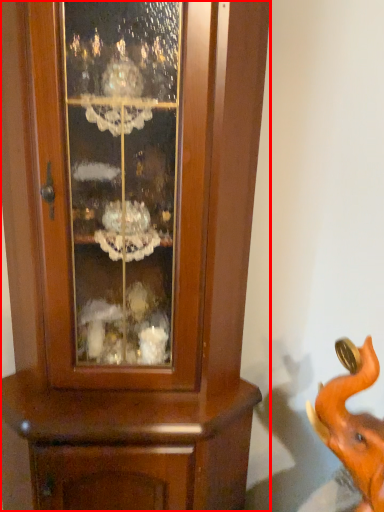
Question: From the image, what is the correct spatial relationship of cupboard (annotated by the red box) in relation to elephant?

Choices:
 (A) left
 (B) right

Answer: (A)